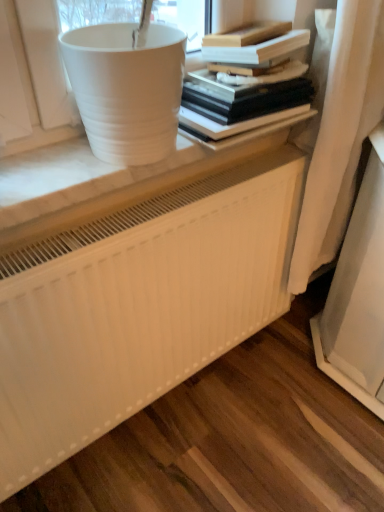
The height and width of the screenshot is (512, 384). I want to click on empty space that is ontop of hardcover books at upper center, so click(234, 77).